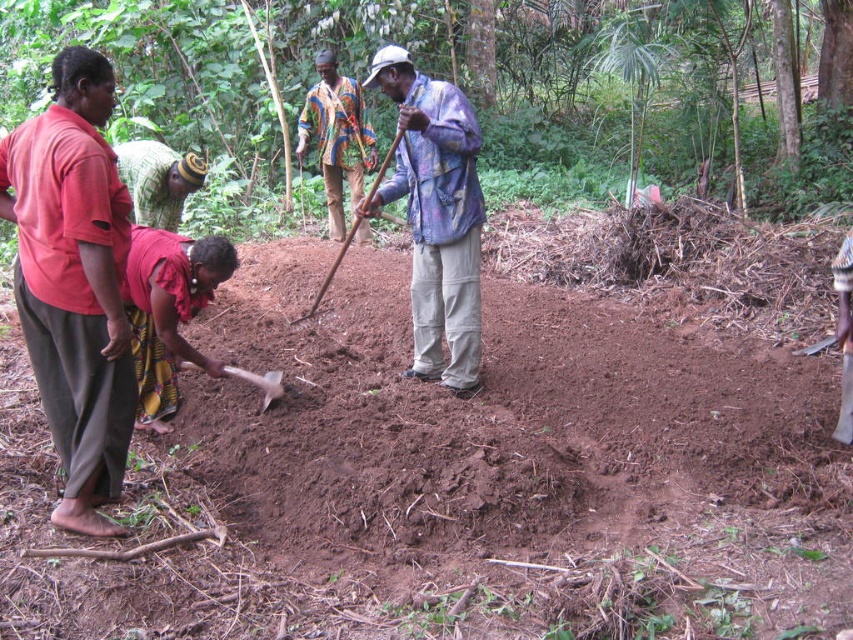
Between point (22, 333) and point (161, 403), which one is positioned behind?

Point (161, 403)

Does matte red shirt at left have a greater height compared to yellow patterned cloth at lower left?

Yes.

Is point (93, 321) behind point (201, 365)?

That is False.

The height and width of the screenshot is (640, 853). What are the coordinates of `matte red shirt at left` in the screenshot? It's located at (74, 282).

Does brown soil at center appear on the right side of brown dirt at center?

No, brown soil at center is not to the right of brown dirt at center.

Does brown soil at center have a lesser height compared to brown dirt at center?

Indeed, brown soil at center has a lesser height compared to brown dirt at center.

You are a GUI agent. You are given a task and a screenshot of the screen. Output one action in this format:
    pyautogui.click(x=<x>, y=<y>)
    Task: Click on the brown soil at center
    This screenshot has height=640, width=853.
    Given the screenshot: What is the action you would take?
    pyautogui.click(x=451, y=477)

Find the location of `brown soil at center`. brown soil at center is located at coordinates (451, 477).

Which is behind, point (149, 360) or point (328, 163)?

The point (328, 163) is behind.

Can you confirm if yellow patterned cloth at lower left is smaller than multicolored fabric shirt at center?

Yes.

Find the location of `yellow patterned cloth at lower left`. yellow patterned cloth at lower left is located at coordinates (167, 310).